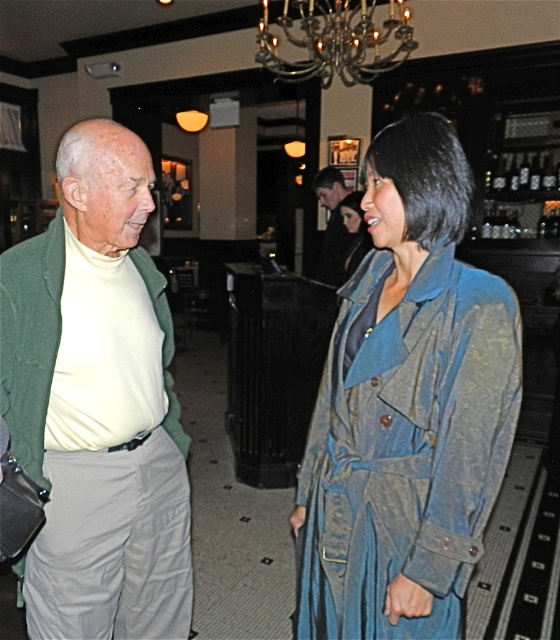
You are standing in the bar and want to place a small table at the point marked as point (330, 252). If the table requires at least 3 meters of space from the nearest wall, can you safely place it there?

The distance of point (330, 252) from camera is 3.34 meters, so yes, the table can be placed there as it meets the required distance from the nearest wall.

In the scene described, there are two notable features visible to an observer looking at the image. These are the blue denim trench coat at center and the smooth black hair at upper center. Based on their positions, which object is located to the left of the other?

The blue denim trench coat at center is positioned to the left of smooth black hair at upper center.

Please look at the point marked at coordinates (x=333, y=227). What object is located there?

The point at (x=333, y=227) corresponds to the smooth black hair at upper center.